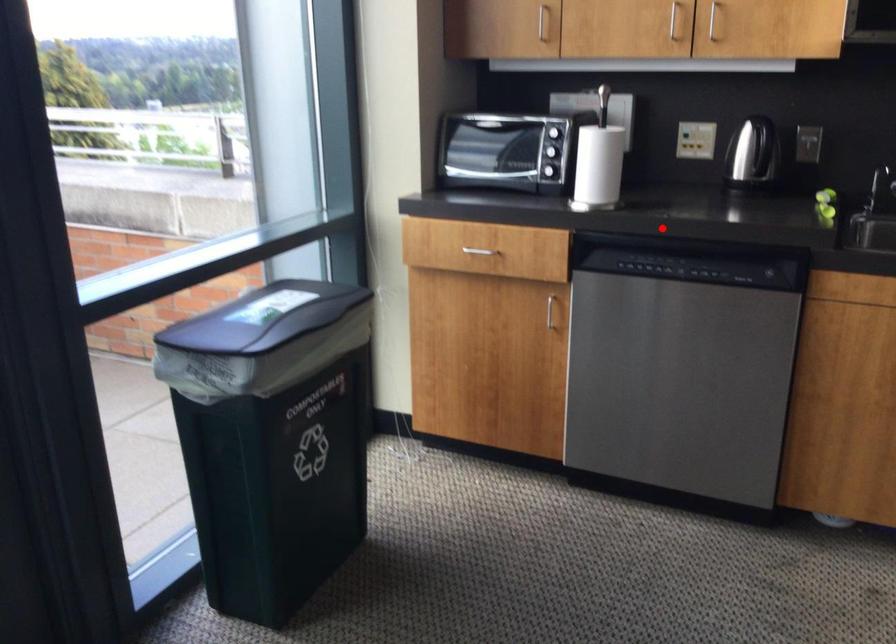
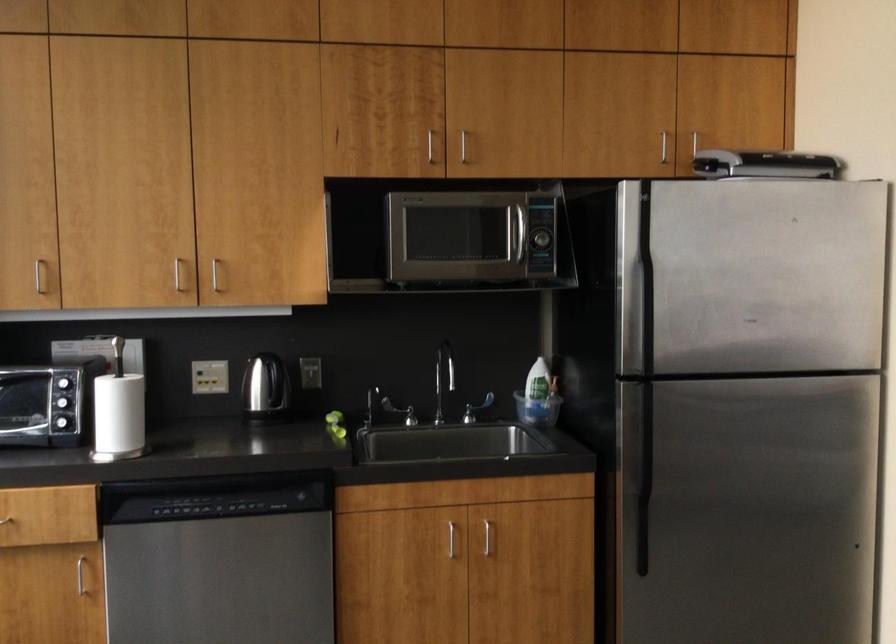
Where in the second image is the point corresponding to the highlighted location from the first image?

(208, 471)